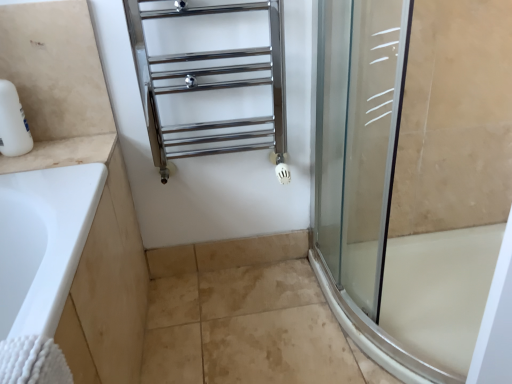
Question: Is beige tile at lower center located outside polished chrome towel rack at upper center?

Choices:
 (A) yes
 (B) no

Answer: (A)

Question: Is beige tile at lower center at the left side of polished chrome towel rack at upper center?

Choices:
 (A) yes
 (B) no

Answer: (B)

Question: Is beige tile at lower center thinner than polished chrome towel rack at upper center?

Choices:
 (A) no
 (B) yes

Answer: (B)

Question: From the image's perspective, is beige tile at lower center beneath polished chrome towel rack at upper center?

Choices:
 (A) yes
 (B) no

Answer: (A)

Question: Can you confirm if beige tile at lower center is smaller than polished chrome towel rack at upper center?

Choices:
 (A) yes
 (B) no

Answer: (A)

Question: Is beige tile at lower center far from polished chrome towel rack at upper center?

Choices:
 (A) no
 (B) yes

Answer: (A)

Question: Does polished chrome towel rack at upper center have a smaller size compared to beige tile at lower center?

Choices:
 (A) no
 (B) yes

Answer: (A)

Question: Does polished chrome towel rack at upper center come behind beige tile at lower center?

Choices:
 (A) yes
 (B) no

Answer: (B)

Question: Are polished chrome towel rack at upper center and beige tile at lower center far apart?

Choices:
 (A) no
 (B) yes

Answer: (A)

Question: Is polished chrome towel rack at upper center positioned before beige tile at lower center?

Choices:
 (A) no
 (B) yes

Answer: (B)

Question: Can you confirm if polished chrome towel rack at upper center is bigger than beige tile at lower center?

Choices:
 (A) yes
 (B) no

Answer: (A)

Question: Would you say polished chrome towel rack at upper center contains beige tile at lower center?

Choices:
 (A) no
 (B) yes

Answer: (A)

Question: Is polished chrome towel rack at upper center further to camera compared to white marble counter at left?

Choices:
 (A) yes
 (B) no

Answer: (B)